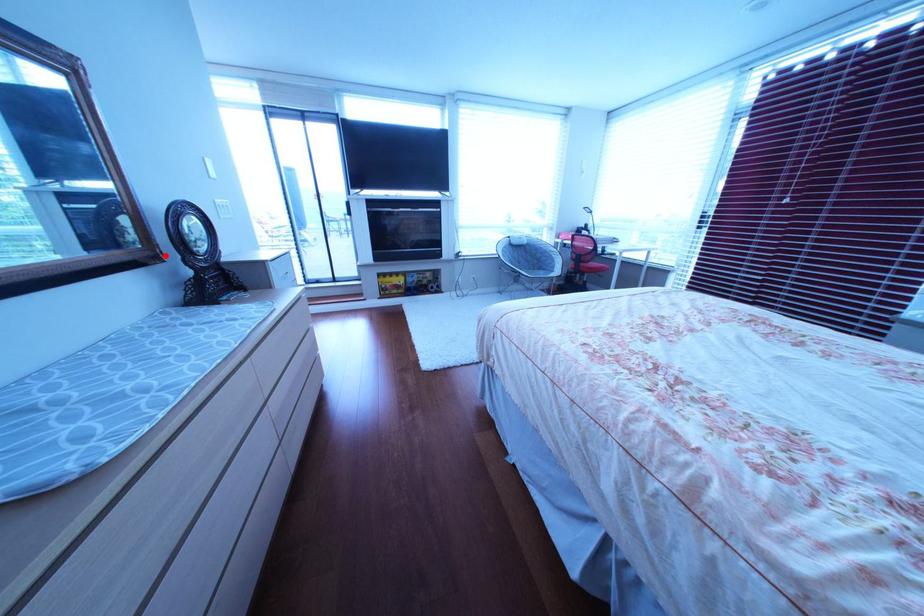
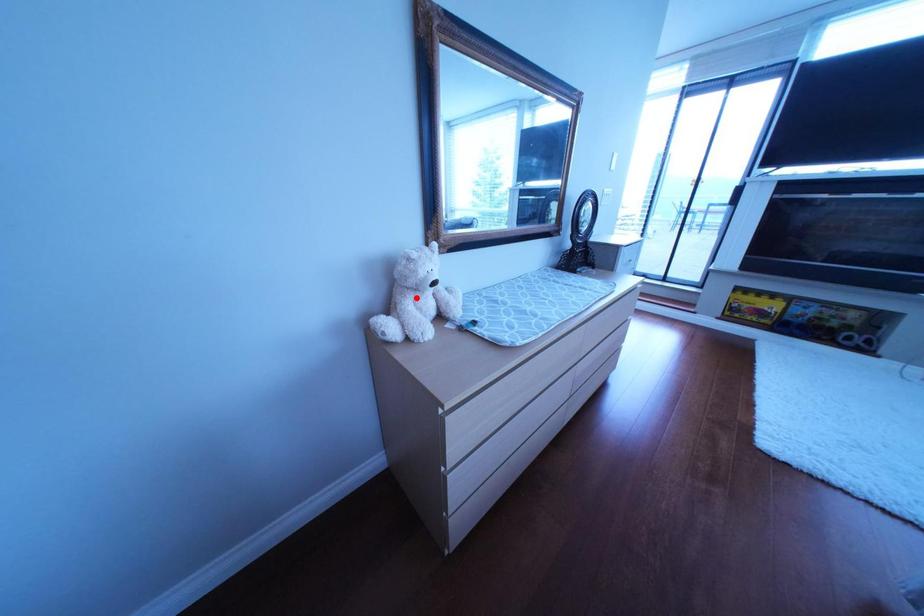
I am providing you with two images of the same scene from different viewpoints. A red point is marked on the first image and another point is marked on the second image. Are the points marked in image1 and image2 representing the same 3D position?

No